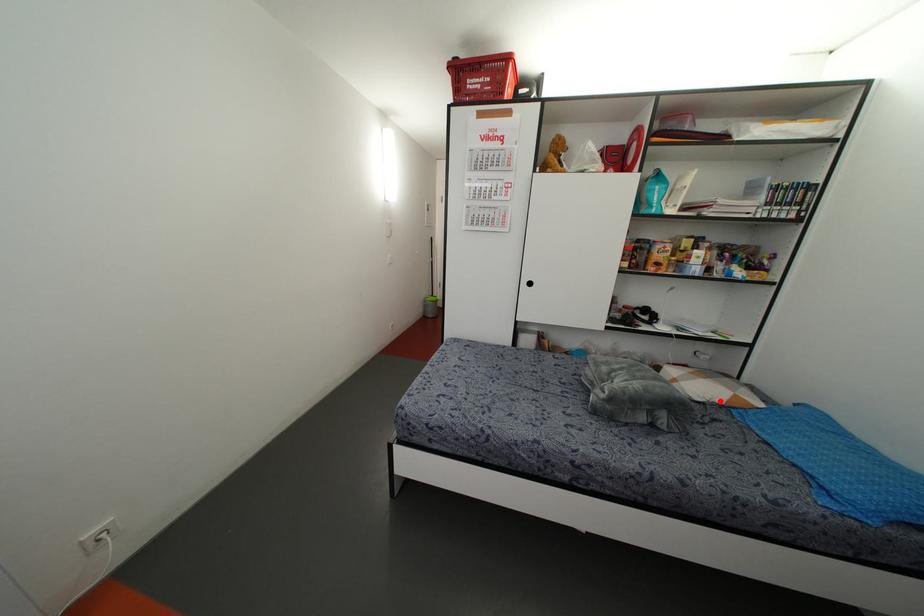
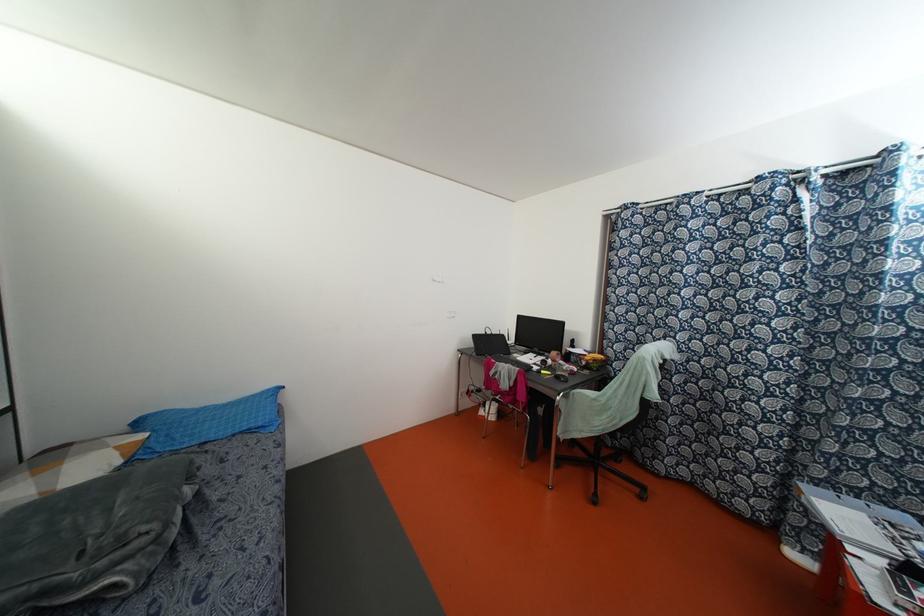
In the second image, find the point that corresponds to the highlighted location in the first image.

(118, 461)